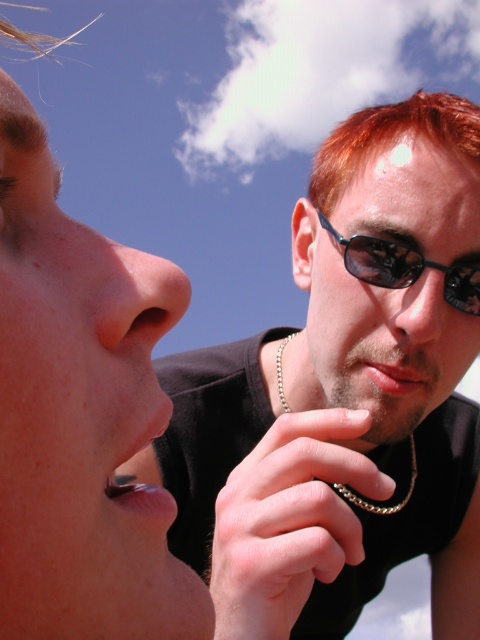
You are a photographer trying to focus on the smooth skin hand at center in the image. Where exactly should you adjust your camera to capture it clearly?

The smooth skin hand at center is located at coordinates point (288, 520), so adjust your camera focus to that point to capture it clearly.

You are taking a photo of the two people in the image. The camera you are using has a rectangular viewfinder with a 0.15x0.15 magnification. To ensure the reddish hair at upper right is fully visible in the photo, where should you position the camera viewfinder relative to the point marked at point (392,138)?

The point (392,138) marks the location of the reddish hair at upper right. To ensure it is fully visible within the 0.15x0.15 viewfinder, the viewfinder should be positioned so that the point is centered within the viewfinder. This will ensure the reddish hair at upper right is captured in the photo.